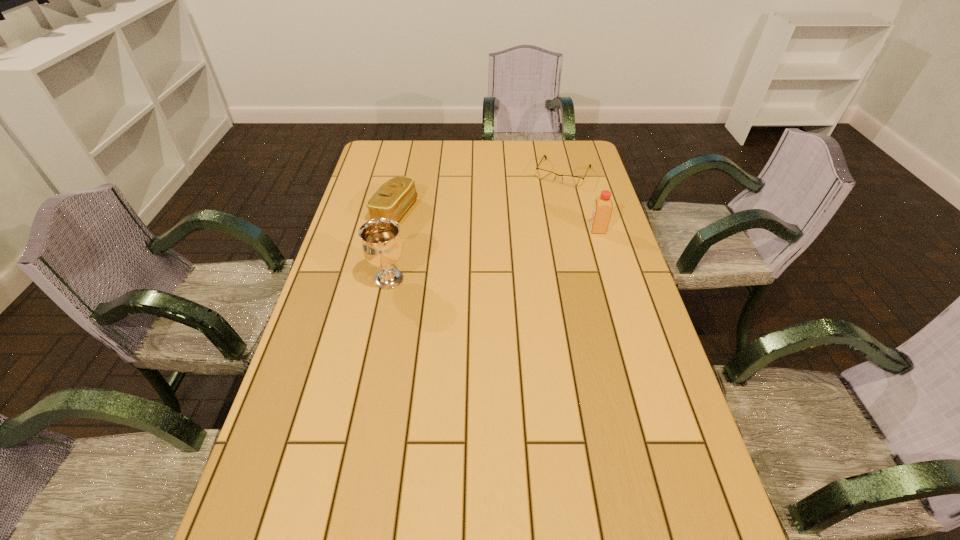
Where is `chalice`? The height and width of the screenshot is (540, 960). chalice is located at coordinates (382, 246).

At what (x,y) coordinates should I click in order to perform the action: click on the nearest object. Please return your answer as a coordinate pair (x, y). Image resolution: width=960 pixels, height=540 pixels. Looking at the image, I should click on click(x=382, y=246).

Image resolution: width=960 pixels, height=540 pixels. I want to click on orange juice, so click(603, 205).

The height and width of the screenshot is (540, 960). Find the location of `the third tallest object`. the third tallest object is located at coordinates (391, 200).

I want to click on the shortest object, so click(x=573, y=181).

You are a GUI agent. You are given a task and a screenshot of the screen. Output one action in this format:
    pyautogui.click(x=<x>, y=<y>)
    Task: Click on the spectacles
    This screenshot has width=960, height=540.
    Given the screenshot: What is the action you would take?
    pyautogui.click(x=573, y=181)

Identify the location of free region located 0.330m on the right of the chalice. Image resolution: width=960 pixels, height=540 pixels. (521, 279).

You are a GUI agent. You are given a task and a screenshot of the screen. Output one action in this format:
    pyautogui.click(x=<x>, y=<y>)
    Task: Click on the vacant region located on the front and back of the orange juice
    The width and height of the screenshot is (960, 540).
    Given the screenshot: What is the action you would take?
    pyautogui.click(x=571, y=230)

Where is `vacant space situated on the front and back of the orange juice`? This screenshot has height=540, width=960. vacant space situated on the front and back of the orange juice is located at coordinates (501, 230).

The height and width of the screenshot is (540, 960). Find the location of `vacant space located on the front and back of the orange juice`. vacant space located on the front and back of the orange juice is located at coordinates (492, 230).